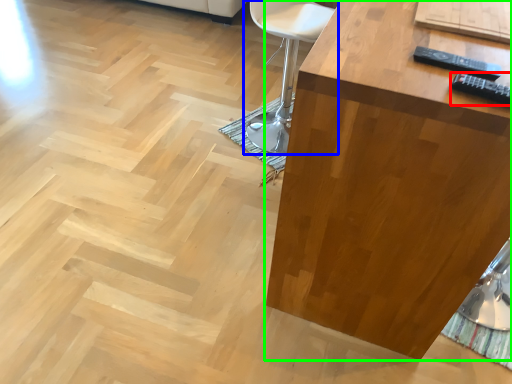
Question: Which object is positioned closest to remote (highlighted by a red box)? Select from chair (highlighted by a blue box) and table (highlighted by a green box).

Choices:
 (A) chair
 (B) table

Answer: (B)